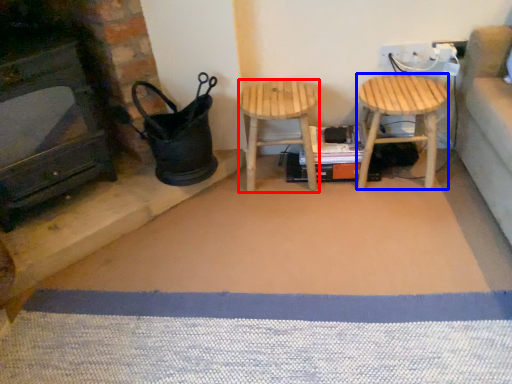
Question: Which point is further to the camera, stool (highlighted by a red box) or stool (highlighted by a blue box)?

Choices:
 (A) stool
 (B) stool

Answer: (A)